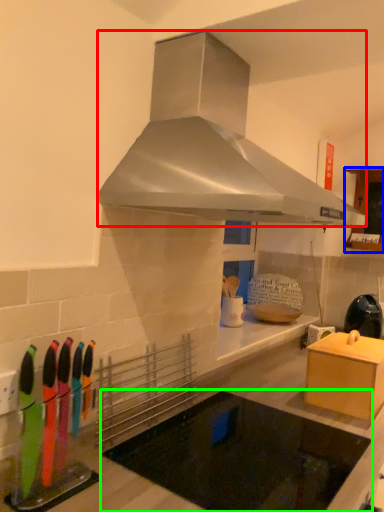
Question: Which object is positioned farthest from home appliance (highlighted by a red box)? Select from cabinetry (highlighted by a blue box) and appliance (highlighted by a green box).

Choices:
 (A) cabinetry
 (B) appliance

Answer: (A)